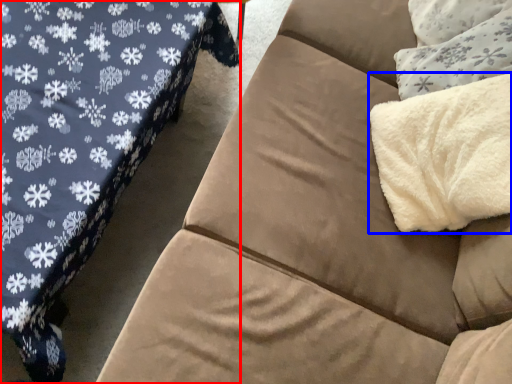
Question: Which object appears closest to the camera in this image, studio couch (highlighted by a red box) or blanket (highlighted by a blue box)?

Choices:
 (A) studio couch
 (B) blanket

Answer: (A)